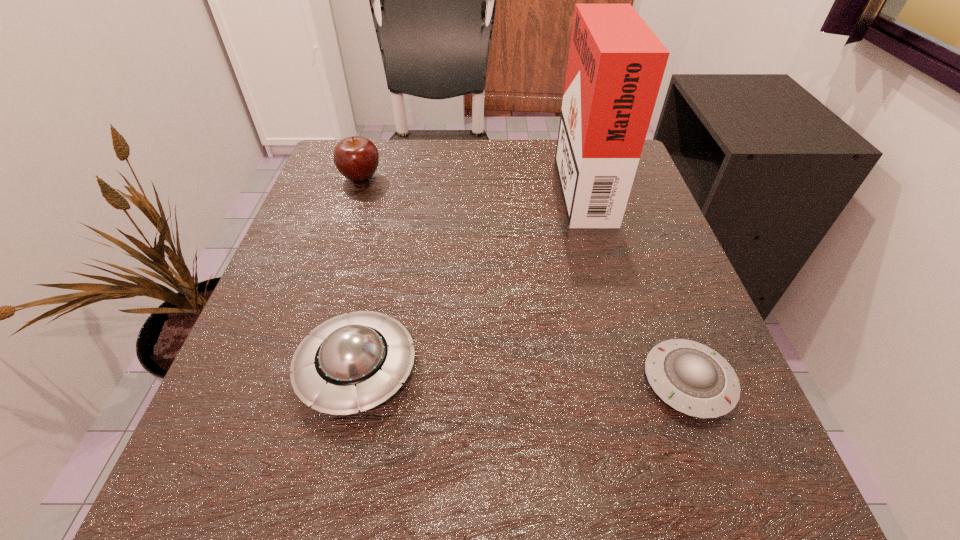
At what (x,y) coordinates should I click in order to perform the action: click on empty space that is in between the tallest object and the left saucer. Please return your answer as a coordinate pair (x, y). This screenshot has height=540, width=960. Looking at the image, I should click on (469, 276).

Image resolution: width=960 pixels, height=540 pixels. I want to click on unoccupied position between the third shortest object and the cigarette case, so click(x=471, y=180).

Find the location of a particular element. This screenshot has height=540, width=960. blank region between the second tallest object and the left saucer is located at coordinates (359, 273).

Identify the location of vacant space in between the apple and the cigarette case. (471, 180).

Where is `unoccupied area between the right saucer and the third tallest object`? The height and width of the screenshot is (540, 960). unoccupied area between the right saucer and the third tallest object is located at coordinates (523, 375).

Where is `blank region between the left saucer and the tallest object`? blank region between the left saucer and the tallest object is located at coordinates (469, 276).

Image resolution: width=960 pixels, height=540 pixels. In order to click on free space between the cigarette case and the second shortest object in this screenshot , I will do `click(469, 276)`.

Locate which object is the closest to the apple. Please provide its 2D coordinates. Your answer should be formatted as a tuple, i.e. [(x, y)], where the tuple contains the x and y coordinates of a point satisfying the conditions above.

[(356, 361)]

The width and height of the screenshot is (960, 540). Find the location of `the closest object to the apple`. the closest object to the apple is located at coordinates (356, 361).

Identify the location of free location that satisfies the following two spatial constraints: 1. on the front-facing side of the cigarette case; 2. on the left side of the shortest object. Image resolution: width=960 pixels, height=540 pixels. (637, 382).